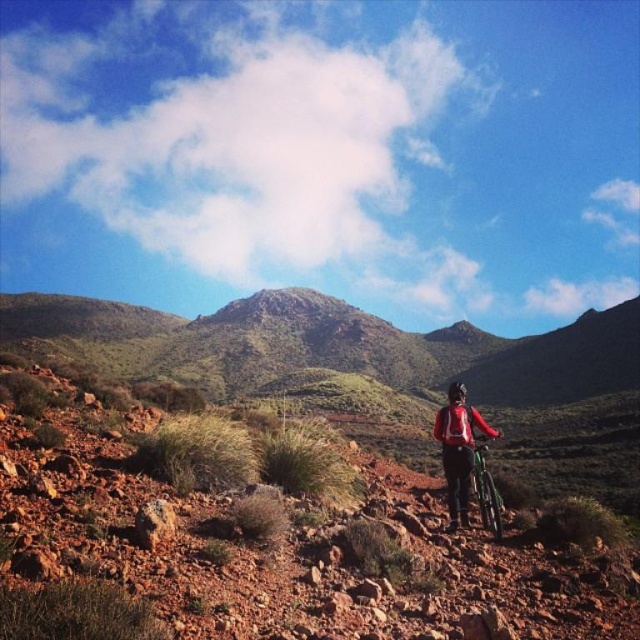
Between red matte jacket at center and green metallic mountain bike at center, which one is positioned higher?

Positioned higher is red matte jacket at center.

The image size is (640, 640). Describe the element at coordinates (458, 449) in the screenshot. I see `red matte jacket at center` at that location.

Where is `red matte jacket at center`? The height and width of the screenshot is (640, 640). red matte jacket at center is located at coordinates (458, 449).

The height and width of the screenshot is (640, 640). What are the coordinates of `red matte jacket at center` in the screenshot? It's located at (458, 449).